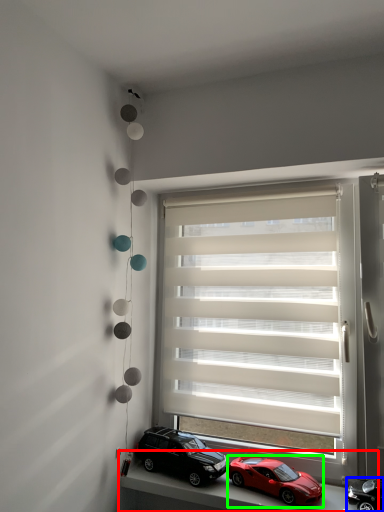
Question: Which is nearer to the window sill (highlighted by a red box)? car (highlighted by a blue box) or car (highlighted by a green box).

Choices:
 (A) car
 (B) car

Answer: (B)